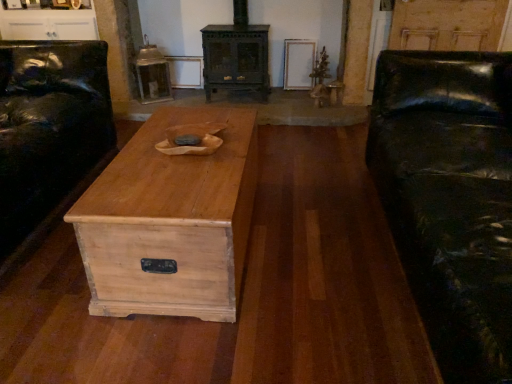
Question: Is black leather couch at left facing away from black leather couch at right?

Choices:
 (A) yes
 (B) no

Answer: (B)

Question: Could you tell me if black leather couch at left is turned towards black leather couch at right?

Choices:
 (A) no
 (B) yes

Answer: (B)

Question: Considering the relative sizes of black leather couch at left and black leather couch at right in the image provided, is black leather couch at left taller than black leather couch at right?

Choices:
 (A) no
 (B) yes

Answer: (A)

Question: Is black leather couch at left at the right side of black leather couch at right?

Choices:
 (A) no
 (B) yes

Answer: (A)

Question: Does black leather couch at left appear on the left side of black leather couch at right?

Choices:
 (A) yes
 (B) no

Answer: (A)

Question: Does black leather couch at left have a lesser width compared to black leather couch at right?

Choices:
 (A) yes
 (B) no

Answer: (A)

Question: Is black leather couch at right in contact with white glossy cabinet at upper left?

Choices:
 (A) no
 (B) yes

Answer: (A)

Question: Is black leather couch at right aimed at white glossy cabinet at upper left?

Choices:
 (A) no
 (B) yes

Answer: (A)

Question: Are black leather couch at right and white glossy cabinet at upper left located far from each other?

Choices:
 (A) yes
 (B) no

Answer: (A)

Question: Considering the relative positions of black leather couch at right and white glossy cabinet at upper left in the image provided, is black leather couch at right to the left of white glossy cabinet at upper left from the viewer's perspective?

Choices:
 (A) no
 (B) yes

Answer: (A)

Question: Can you confirm if black leather couch at right is wider than white glossy cabinet at upper left?

Choices:
 (A) yes
 (B) no

Answer: (A)

Question: Is the position of black leather couch at right less distant than that of white glossy cabinet at upper left?

Choices:
 (A) yes
 (B) no

Answer: (A)

Question: Is black leather couch at left next to natural wood chest at center and touching it?

Choices:
 (A) yes
 (B) no

Answer: (B)